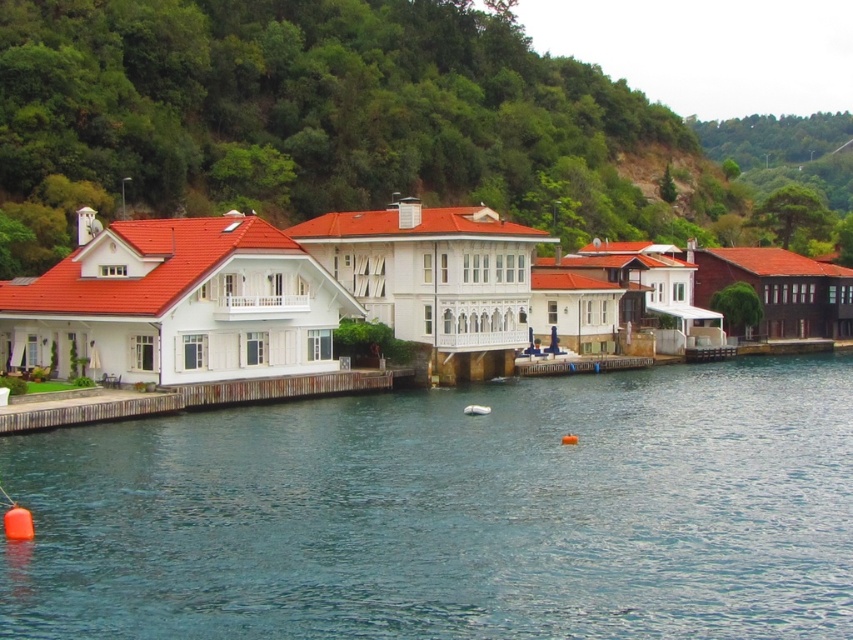
Question: Which object is closer to the camera taking this photo?

Choices:
 (A) wooden dock at lower left
 (B) blue water at center

Answer: (B)

Question: Does blue water at center have a larger size compared to wooden dock at lower left?

Choices:
 (A) yes
 (B) no

Answer: (A)

Question: Is blue water at center further to the viewer compared to wooden dock at lower left?

Choices:
 (A) yes
 (B) no

Answer: (B)

Question: Among these points, which one is nearest to the camera?

Choices:
 (A) (73, 600)
 (B) (50, 410)

Answer: (A)

Question: Does blue water at center appear on the right side of wooden dock at lower left?

Choices:
 (A) no
 (B) yes

Answer: (B)